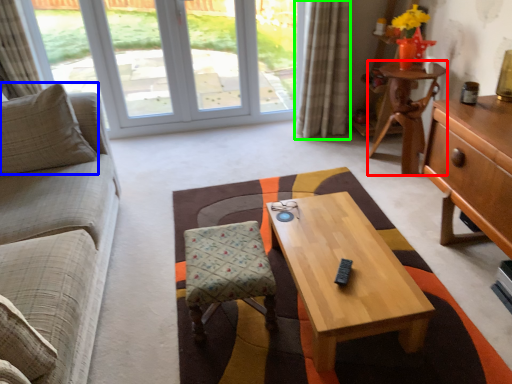
Question: Which object is the farthest from desk (highlighted by a red box)? Choose among these: pillow (highlighted by a blue box) or curtain (highlighted by a green box).

Choices:
 (A) pillow
 (B) curtain

Answer: (A)